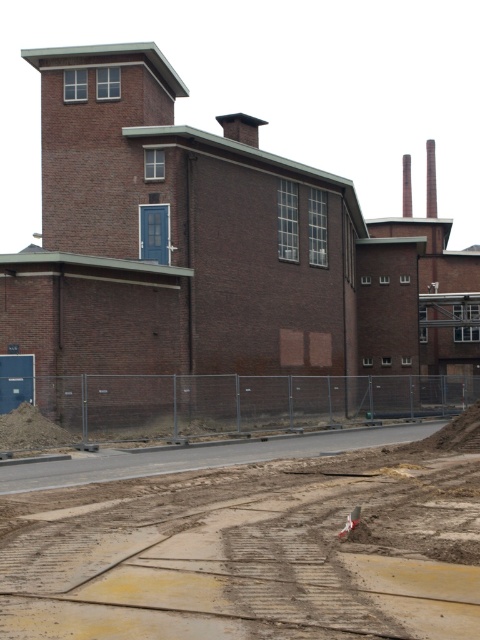
Does brown brick building at center have a greater width compared to brown dirt track at lower center?

Correct, the width of brown brick building at center exceeds that of brown dirt track at lower center.

Between brown brick building at center and brown dirt track at lower center, which one has more height?

With more height is brown brick building at center.

Which is behind, point (204, 428) or point (202, 596)?

Positioned behind is point (204, 428).

This screenshot has width=480, height=640. Find the location of `brown brick building at center`. brown brick building at center is located at coordinates [x=217, y=273].